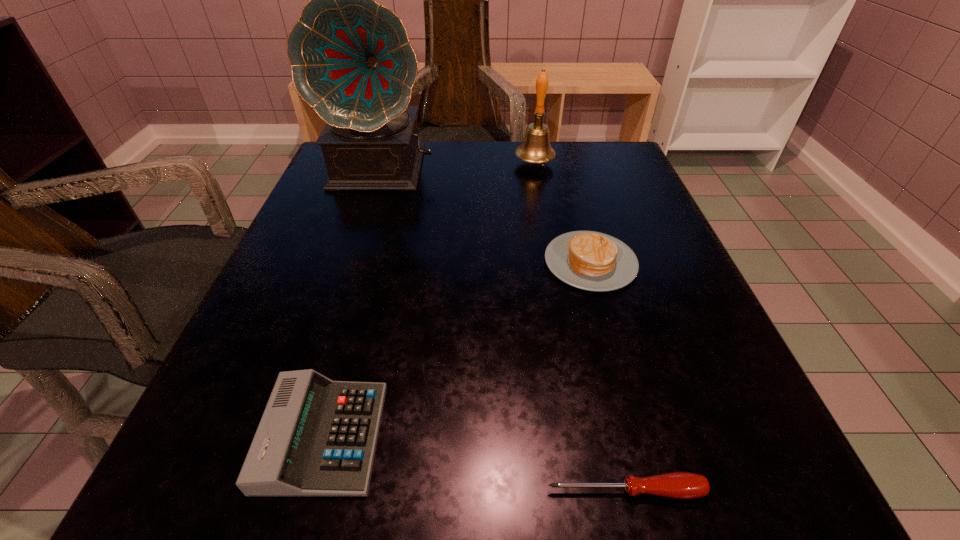
In order to click on record player that is at the far edge in this screenshot , I will do `click(351, 60)`.

Find the location of a particular element. This screenshot has width=960, height=540. bell situated at the far edge is located at coordinates (535, 148).

Identify the location of calculator present at the near edge. (317, 437).

This screenshot has width=960, height=540. I want to click on screwdriver that is at the near edge, so click(x=683, y=485).

Where is `record player situated at the left edge`? The height and width of the screenshot is (540, 960). record player situated at the left edge is located at coordinates (351, 60).

Image resolution: width=960 pixels, height=540 pixels. In order to click on calculator that is at the left edge in this screenshot , I will do `click(317, 437)`.

The image size is (960, 540). Find the location of `pancake that is at the right edge`. pancake that is at the right edge is located at coordinates (588, 260).

Where is `screwdriver that is at the right edge`? screwdriver that is at the right edge is located at coordinates (683, 485).

At what (x,y) coordinates should I click in order to perform the action: click on object present at the far left corner. Please return your answer as a coordinate pair (x, y). The height and width of the screenshot is (540, 960). Looking at the image, I should click on (351, 60).

In order to click on object situated at the near left corner in this screenshot , I will do `click(317, 437)`.